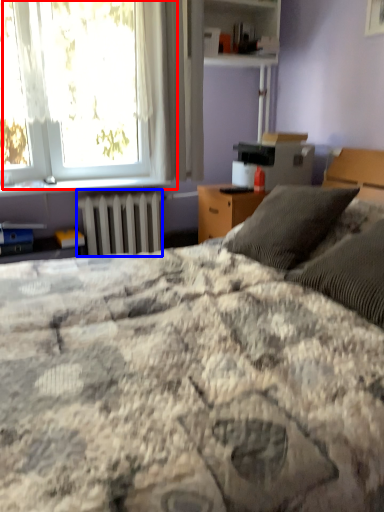
Question: Which point is further to the camera, window (highlighted by a red box) or radiator (highlighted by a blue box)?

Choices:
 (A) window
 (B) radiator

Answer: (B)